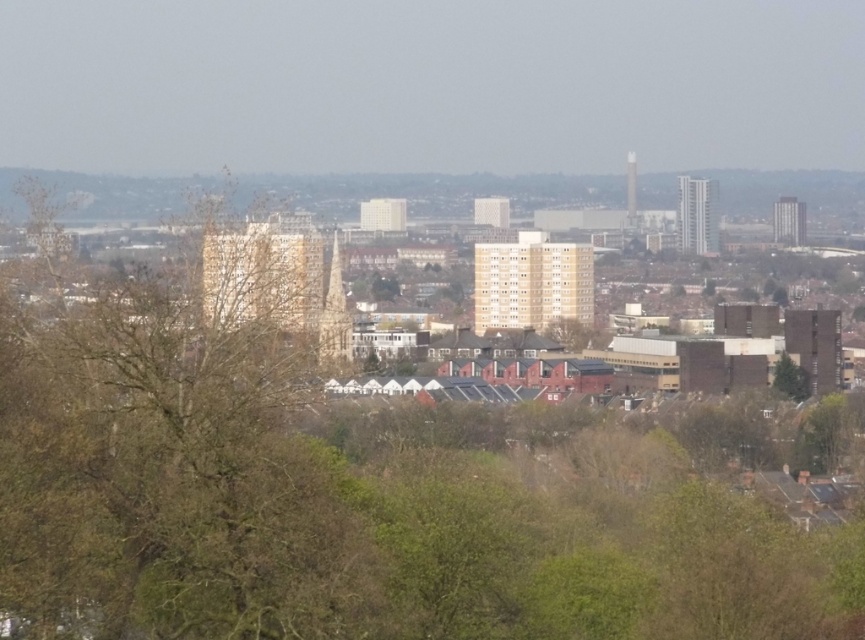
You are standing at the center of the image and want to locate the green leafy tree at lower right. Based on the coordinates provided, in which direction should you look to find it?

The green leafy tree at lower right is located at coordinates point [827,432], which means it is positioned to the right and slightly downward from the center. To locate it, you should look towards the lower right direction from your current position at the center.

You are a bird looking for a nesting spot. You see the brown leafless tree at left and the green leafy tree at lower right. Which tree is taller and would provide a better vantage point?

The brown leafless tree at left is taller than the green leafy tree at lower right, so it would provide a better vantage point.